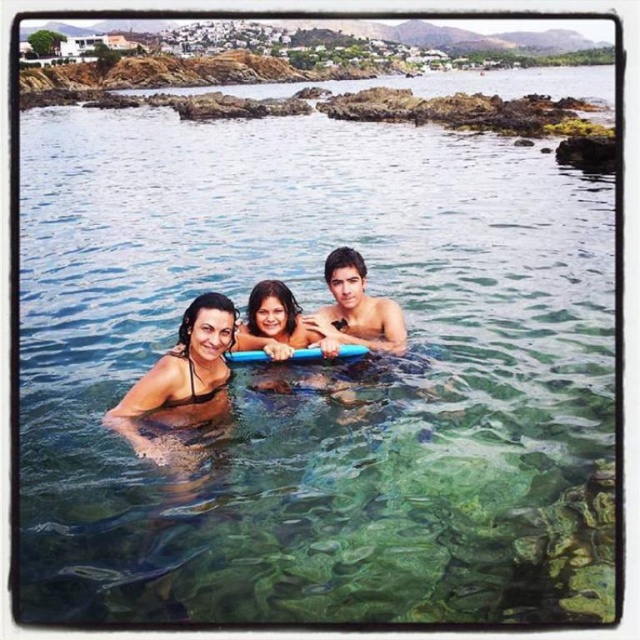
Can you confirm if black matte swimwear at center is positioned to the right of smooth skin man at center?

In fact, black matte swimwear at center is to the left of smooth skin man at center.

Which is in front, point (212, 394) or point (390, 308)?

Point (212, 394) is in front.

In order to click on black matte swimwear at center in this screenshot , I will do `click(252, 348)`.